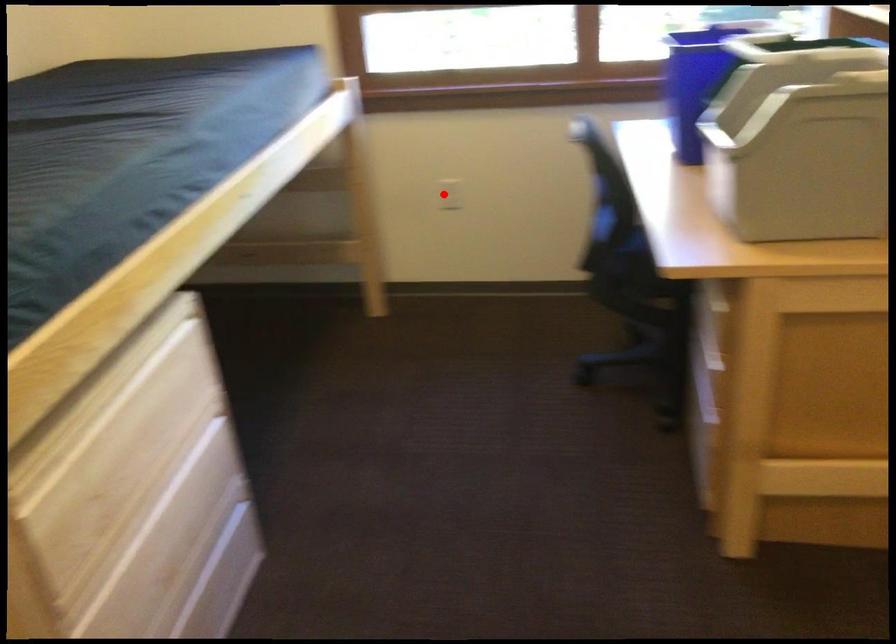
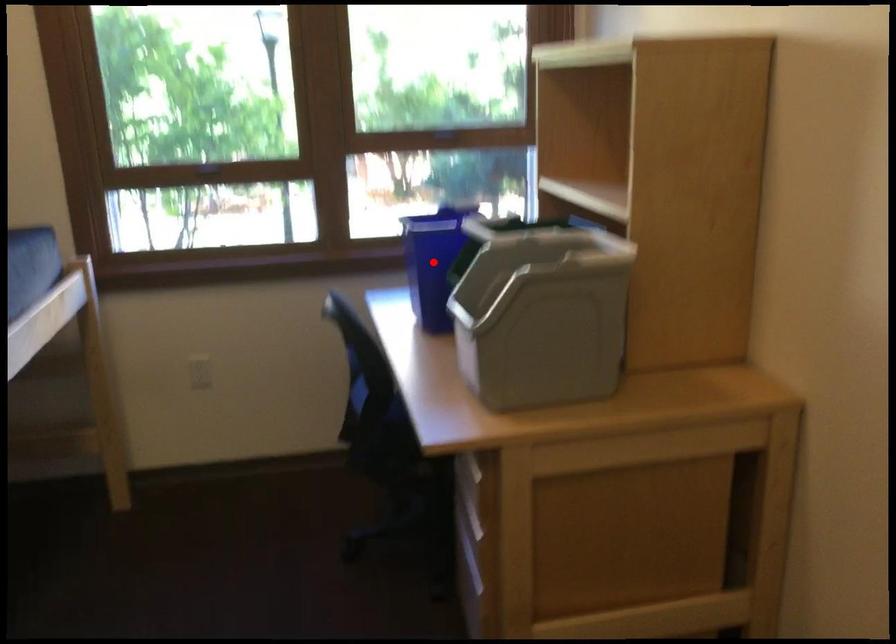
I am providing you with two images of the same scene from different viewpoints. A red point is marked on the first image and another point is marked on the second image. Does the point marked in image1 correspond to the same location as the one in image2?

No